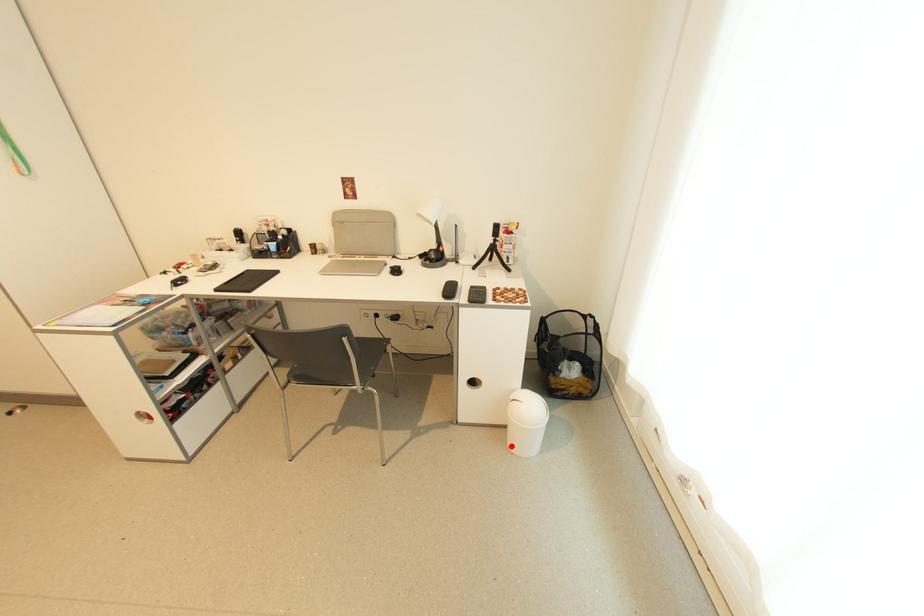
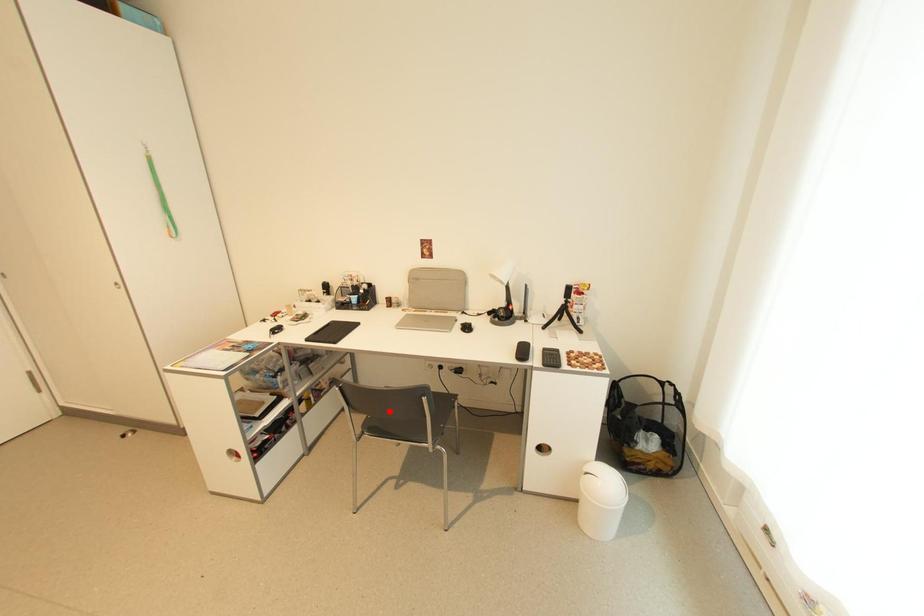
I am providing you with two images of the same scene from different viewpoints. A red point is marked on the first image and another point is marked on the second image. Is the red point in image1 aligned with the point shown in image2?

No